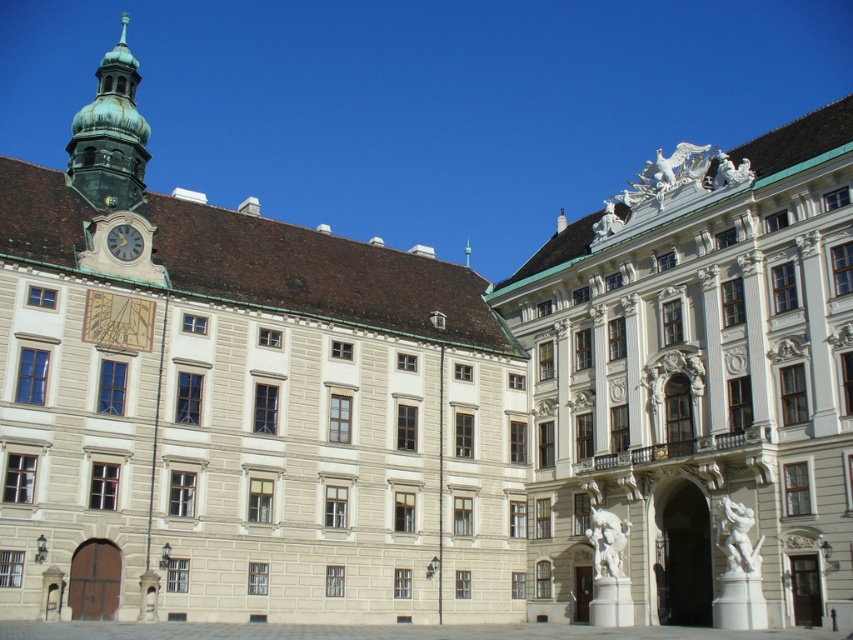
Question: Does beige stone building at center appear over matte gray clock at upper left?

Choices:
 (A) no
 (B) yes

Answer: (B)

Question: Among these objects, which one is farthest from the camera?

Choices:
 (A) white marble statue at upper center
 (B) beige stone building at center
 (C) matte gray clock at upper left
 (D) green copper bell tower at upper left

Answer: (A)

Question: Considering the relative positions of white stone palace at right and matte gray clock at upper left in the image provided, where is white stone palace at right located with respect to matte gray clock at upper left?

Choices:
 (A) left
 (B) right

Answer: (B)

Question: Which point is closer to the camera?

Choices:
 (A) (634, 394)
 (B) (726, 564)

Answer: (B)

Question: Which point is closer to the camera taking this photo?

Choices:
 (A) (115, 246)
 (B) (720, 508)
 (C) (38, 520)

Answer: (C)

Question: Is beige stone building at center thinner than green copper bell tower at upper left?

Choices:
 (A) no
 (B) yes

Answer: (A)